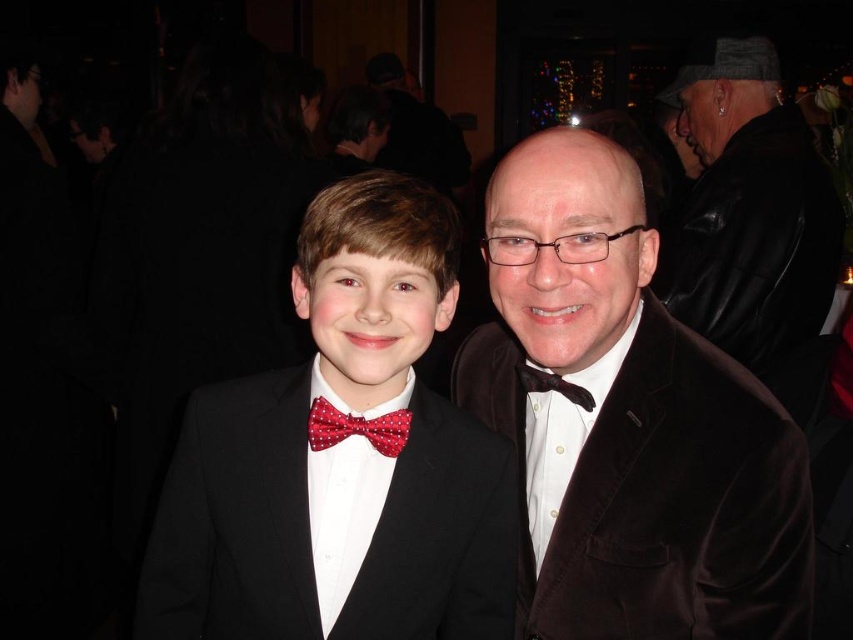
Question: Which point appears farthest from the camera in this image?

Choices:
 (A) (381, 444)
 (B) (346, 225)
 (C) (735, 166)
 (D) (535, 384)

Answer: (C)

Question: Where is velvet brown suit at right located in relation to black leather jacket at upper right in the image?

Choices:
 (A) below
 (B) above

Answer: (A)

Question: Among these points, which one is nearest to the camera?

Choices:
 (A) (323, 580)
 (B) (361, 422)
 (C) (573, 397)
 (D) (752, 218)

Answer: (B)

Question: Considering the real-world distances, which object is closest to the velvet brown suit at right?

Choices:
 (A) black leather jacket at upper right
 (B) matte black suit at center

Answer: (B)

Question: Does black leather jacket at upper right appear on the left side of red dotted bow tie at center?

Choices:
 (A) no
 (B) yes

Answer: (A)

Question: Can you confirm if velvet brown suit at right is thinner than red dotted bow tie at center?

Choices:
 (A) yes
 (B) no

Answer: (B)